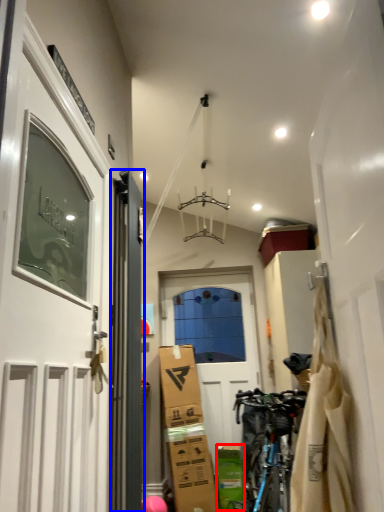
Question: Which object is closer to the camera taking this photo, cardboard box (highlighted by a red box) or door (highlighted by a blue box)?

Choices:
 (A) cardboard box
 (B) door

Answer: (B)